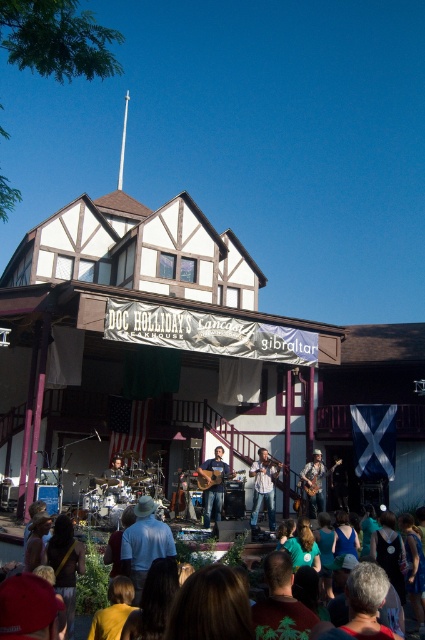
The height and width of the screenshot is (640, 425). In order to click on matte white shirt at center in this screenshot , I will do `click(263, 488)`.

Can you confirm if matte white shirt at center is positioned to the right of shiny brown guitar at center?

No, matte white shirt at center is not to the right of shiny brown guitar at center.

Does point (272, 497) come in front of point (322, 492)?

No, it is behind (322, 492).

Where is `matte white shirt at center`? matte white shirt at center is located at coordinates (263, 488).

Which is more to the right, light blue shirt at center or blue jeans at center?

From the viewer's perspective, blue jeans at center appears more on the right side.

Who is more distant from viewer, (x=147, y=564) or (x=221, y=481)?

Positioned behind is point (x=221, y=481).

You are a GUI agent. You are given a task and a screenshot of the screen. Output one action in this format:
    pyautogui.click(x=<x>, y=<y>)
    Task: Click on the light blue shirt at center
    This screenshot has width=425, height=640.
    Given the screenshot: What is the action you would take?
    pyautogui.click(x=144, y=545)

Where is `light blue shirt at center`? light blue shirt at center is located at coordinates 144,545.

Identify the location of light blue shirt at center. (144, 545).